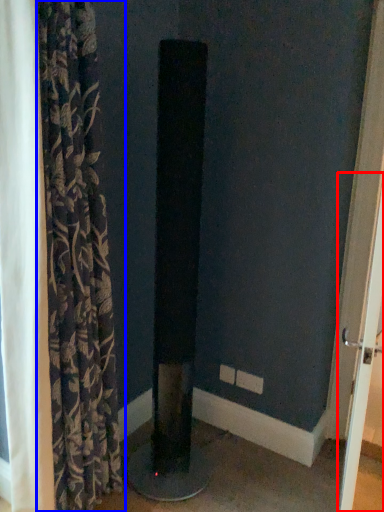
Question: Which object appears farthest to the camera in this image, screen door (highlighted by a red box) or curtain (highlighted by a blue box)?

Choices:
 (A) screen door
 (B) curtain

Answer: (A)